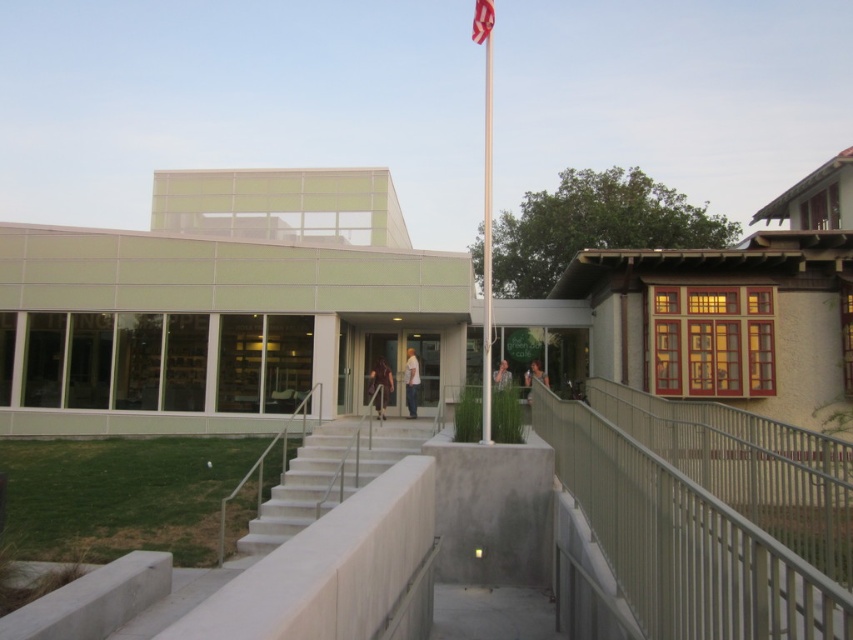
Is dark brown leather jacket at center closer to the viewer compared to matte black jacket at center?

That is True.

Locate an element on the screen. This screenshot has width=853, height=640. dark brown leather jacket at center is located at coordinates click(381, 387).

Locate an element on the screen. The width and height of the screenshot is (853, 640). dark brown leather jacket at center is located at coordinates (381, 387).

Which of these two, matte black jacket at center or light brown leather jacket at center, stands shorter?

light brown leather jacket at center is shorter.

Which is above, matte black jacket at center or light brown leather jacket at center?

light brown leather jacket at center is higher up.

What are the coordinates of `matte black jacket at center` in the screenshot? It's located at (534, 376).

Is metallic gray railing at lower right positioned before white concrete stairs at center?

Yes, metallic gray railing at lower right is in front of white concrete stairs at center.

Does metallic gray railing at lower right appear under white concrete stairs at center?

Actually, metallic gray railing at lower right is above white concrete stairs at center.

What do you see at coordinates (683, 536) in the screenshot? The width and height of the screenshot is (853, 640). I see `metallic gray railing at lower right` at bounding box center [683, 536].

At what (x,y) coordinates should I click in order to perform the action: click on metallic gray railing at lower right. Please return your answer as a coordinate pair (x, y). The width and height of the screenshot is (853, 640). Looking at the image, I should click on (683, 536).